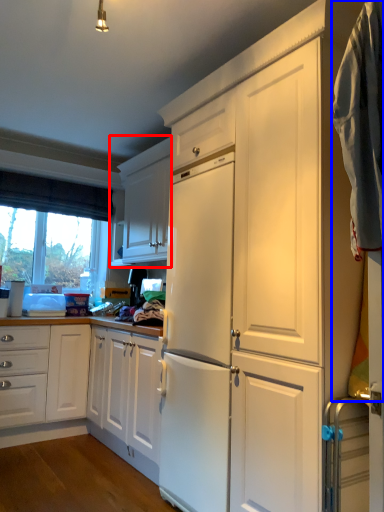
Question: Which of the following is the farthest to the observer, cabinetry (highlighted by a red box) or laundry (highlighted by a blue box)?

Choices:
 (A) cabinetry
 (B) laundry

Answer: (A)